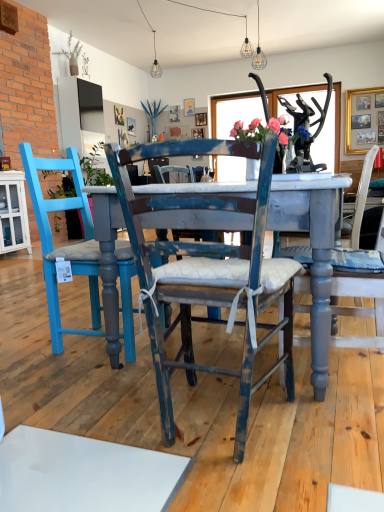
Where is `distressed gray wood chair at center, which is the 3th chair in left-to-right order`? The width and height of the screenshot is (384, 512). distressed gray wood chair at center, which is the 3th chair in left-to-right order is located at coordinates (360, 305).

What do you see at coordinates (360, 305) in the screenshot?
I see `distressed gray wood chair at center, which is the 3th chair in left-to-right order` at bounding box center [360, 305].

Identify the location of matte blue vase with pink roses at center. The image size is (384, 512). coord(264,135).

Considering the relative positions of matte blue vase with pink roses at center and distressed blue chair at center, which appears as the 2th chair when viewed from the right, in the image provided, is matte blue vase with pink roses at center to the right of distressed blue chair at center, which appears as the 2th chair when viewed from the right, from the viewer's perspective?

Correct, you'll find matte blue vase with pink roses at center to the right of distressed blue chair at center, which appears as the 2th chair when viewed from the right.

Would you consider matte blue vase with pink roses at center to be distant from distressed blue chair at center, acting as the second chair starting from the left?

matte blue vase with pink roses at center is far away from distressed blue chair at center, acting as the second chair starting from the left.

Which object is wider, matte blue vase with pink roses at center or distressed blue chair at center, which appears as the 2th chair when viewed from the right?

Wider between the two is distressed blue chair at center, which appears as the 2th chair when viewed from the right.

Choose the correct answer: Is matte blue vase with pink roses at center inside distressed blue chair at center, acting as the second chair starting from the left, or outside it?

matte blue vase with pink roses at center lies outside distressed blue chair at center, acting as the second chair starting from the left.

Where is `picture frame on the right of the blue painted wood chair at left, the 1th chair positioned from the left`? The height and width of the screenshot is (512, 384). picture frame on the right of the blue painted wood chair at left, the 1th chair positioned from the left is located at coordinates (364, 119).

Visually, is gold-framed picture at upper right positioned to the left or to the right of blue painted wood chair at left, positioned as the 3th chair in right-to-left order?

In the image, gold-framed picture at upper right appears on the right side of blue painted wood chair at left, positioned as the 3th chair in right-to-left order.

How different are the orientations of gold-framed picture at upper right and blue painted wood chair at left, the 1th chair positioned from the left, in degrees?

91.2 degrees.

Would you say blue painted wood chair at left, positioned as the 3th chair in right-to-left order, is part of gold-framed picture at upper right's contents?

No, blue painted wood chair at left, positioned as the 3th chair in right-to-left order, is not inside gold-framed picture at upper right.

Does point (309, 284) come farther from viewer compared to point (189, 278)?

Yes, point (309, 284) is farther from viewer.

Who is bigger, distressed gray wood chair at center, which is counted as the first chair, starting from the right, or distressed blue chair at center, which appears as the 2th chair when viewed from the right?

Bigger between the two is distressed blue chair at center, which appears as the 2th chair when viewed from the right.

From the image's perspective, is distressed gray wood chair at center, which is the 3th chair in left-to-right order, over distressed blue chair at center, acting as the second chair starting from the left?

Yes, from the image's perspective, distressed gray wood chair at center, which is the 3th chair in left-to-right order, is on top of distressed blue chair at center, acting as the second chair starting from the left.

Considering the positions of objects distressed gray wood chair at center, which is the 3th chair in left-to-right order, and distressed blue chair at center, which appears as the 2th chair when viewed from the right, in the image provided, who is more to the left, distressed gray wood chair at center, which is the 3th chair in left-to-right order, or distressed blue chair at center, which appears as the 2th chair when viewed from the right,?

distressed blue chair at center, which appears as the 2th chair when viewed from the right.

Between distressed gray wood chair at center, which is the 3th chair in left-to-right order, and gold-framed picture at upper right, which one has larger width?

distressed gray wood chair at center, which is the 3th chair in left-to-right order, is wider.

Does distressed gray wood chair at center, which is the 3th chair in left-to-right order, turn towards gold-framed picture at upper right?

No, distressed gray wood chair at center, which is the 3th chair in left-to-right order, does not turn towards gold-framed picture at upper right.

From a real-world perspective, which is physically above, blue painted wood chair at left, positioned as the 3th chair in right-to-left order, or gold-framed picture at upper right?

gold-framed picture at upper right.

Considering the sizes of objects blue painted wood chair at left, the 1th chair positioned from the left, and gold-framed picture at upper right in the image provided, who is smaller, blue painted wood chair at left, the 1th chair positioned from the left, or gold-framed picture at upper right?

With smaller size is gold-framed picture at upper right.

Is blue painted wood chair at left, the 1th chair positioned from the left, wider or thinner than gold-framed picture at upper right?

Considering their sizes, blue painted wood chair at left, the 1th chair positioned from the left, looks broader than gold-framed picture at upper right.

Which of these two, blue painted wood chair at left, the 1th chair positioned from the left, or gold-framed picture at upper right, stands taller?

gold-framed picture at upper right.

Relative to distressed gray wood chair at center, which is counted as the first chair, starting from the right, is blue painted wood chair at left, the 1th chair positioned from the left, in front or behind?

Visually, blue painted wood chair at left, the 1th chair positioned from the left, is located behind distressed gray wood chair at center, which is counted as the first chair, starting from the right.

Do you think blue painted wood chair at left, positioned as the 3th chair in right-to-left order, is within distressed gray wood chair at center, which is counted as the first chair, starting from the right, or outside of it?

blue painted wood chair at left, positioned as the 3th chair in right-to-left order, is not inside distressed gray wood chair at center, which is counted as the first chair, starting from the right, it's outside.

From the image's perspective, between blue painted wood chair at left, the 1th chair positioned from the left, and distressed gray wood chair at center, which is counted as the first chair, starting from the right, which one is located above?

blue painted wood chair at left, the 1th chair positioned from the left.

From a real-world perspective, who is located higher, blue painted wood chair at left, positioned as the 3th chair in right-to-left order, or distressed gray wood chair at center, which is counted as the first chair, starting from the right?

blue painted wood chair at left, positioned as the 3th chair in right-to-left order, from a real-world perspective.

The width and height of the screenshot is (384, 512). Identify the location of the 1st chair counting from the left of the distressed gray wood chair at center, which is counted as the first chair, starting from the right. (205, 273).

Is the depth of distressed blue chair at center, acting as the second chair starting from the left, greater than that of distressed gray wood chair at center, which is counted as the first chair, starting from the right?

No, distressed blue chair at center, acting as the second chair starting from the left, is in front of distressed gray wood chair at center, which is counted as the first chair, starting from the right.

From a real-world perspective, is distressed blue chair at center, acting as the second chair starting from the left, physically above distressed gray wood chair at center, which is counted as the first chair, starting from the right?

No, from a real-world perspective, distressed blue chair at center, acting as the second chair starting from the left, is not on top of distressed gray wood chair at center, which is counted as the first chair, starting from the right.

Locate an element on the screen. The height and width of the screenshot is (512, 384). the 1st chair to the left when counting from the matte blue vase with pink roses at center is located at coordinates (205, 273).

The image size is (384, 512). I want to click on picture frame on the right of the blue painted wood chair at left, positioned as the 3th chair in right-to-left order, so pos(364,119).

Looking at the image, which one is located further to distressed blue chair at center, which appears as the 2th chair when viewed from the right, matte blue vase with pink roses at center or distressed gray wood chair at center, which is the 3th chair in left-to-right order?

Among the two, matte blue vase with pink roses at center is located further to distressed blue chair at center, which appears as the 2th chair when viewed from the right.

Looking at the image, which one is located closer to distressed gray wood chair at center, which is the 3th chair in left-to-right order, blue painted wood chair at left, the 1th chair positioned from the left, or gold-framed picture at upper right?

blue painted wood chair at left, the 1th chair positioned from the left, is closer to distressed gray wood chair at center, which is the 3th chair in left-to-right order.

Based on their spatial positions, is distressed gray wood chair at center, which is the 3th chair in left-to-right order, or distressed blue chair at center, acting as the second chair starting from the left, closer to matte blue vase with pink roses at center?

distressed gray wood chair at center, which is the 3th chair in left-to-right order, lies closer to matte blue vase with pink roses at center than the other object.

Which object lies nearer to the anchor point matte blue vase with pink roses at center, distressed gray wood chair at center, which is counted as the first chair, starting from the right, or blue painted wood chair at left, the 1th chair positioned from the left?

distressed gray wood chair at center, which is counted as the first chair, starting from the right.

When comparing their distances from distressed blue chair at center, acting as the second chair starting from the left, does gold-framed picture at upper right or blue painted wood chair at left, positioned as the 3th chair in right-to-left order, seem further?

Among the two, gold-framed picture at upper right is located further to distressed blue chair at center, acting as the second chair starting from the left.

Considering their positions, is matte blue vase with pink roses at center positioned closer to distressed gray wood chair at center, which is counted as the first chair, starting from the right, than gold-framed picture at upper right?

matte blue vase with pink roses at center is positioned closer to the anchor distressed gray wood chair at center, which is counted as the first chair, starting from the right.

Which object lies further to the anchor point gold-framed picture at upper right, distressed blue chair at center, acting as the second chair starting from the left, or blue painted wood chair at left, positioned as the 3th chair in right-to-left order?

Among the two, distressed blue chair at center, acting as the second chair starting from the left, is located further to gold-framed picture at upper right.

From the image, which object appears to be nearer to matte blue vase with pink roses at center, blue painted wood chair at left, the 1th chair positioned from the left, or distressed gray wood chair at center, which is counted as the first chair, starting from the right?

distressed gray wood chair at center, which is counted as the first chair, starting from the right, is positioned closer to the anchor matte blue vase with pink roses at center.

This screenshot has width=384, height=512. Identify the location of floral arrangement located between distressed blue chair at center, acting as the second chair starting from the left, and gold-framed picture at upper right in the depth direction. (264, 135).

This screenshot has height=512, width=384. I want to click on chair situated between blue painted wood chair at left, the 1th chair positioned from the left, and distressed gray wood chair at center, which is counted as the first chair, starting from the right, from left to right, so click(205, 273).

Identify the location of chair located between distressed gray wood chair at center, which is counted as the first chair, starting from the right, and gold-framed picture at upper right in the depth direction. (66, 246).

This screenshot has height=512, width=384. Identify the location of floral arrangement located between blue painted wood chair at left, positioned as the 3th chair in right-to-left order, and gold-framed picture at upper right in the depth direction. (x=264, y=135).